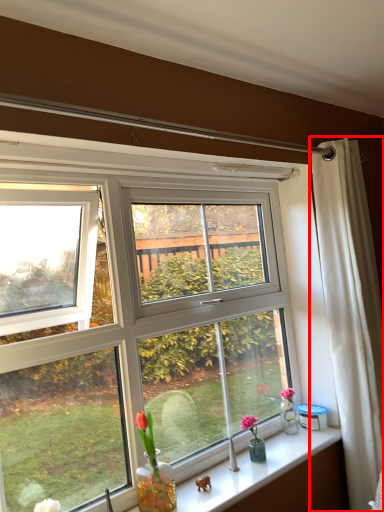
Question: In this image, where is curtain (annotated by the red box) located relative to window sill?

Choices:
 (A) left
 (B) right

Answer: (B)